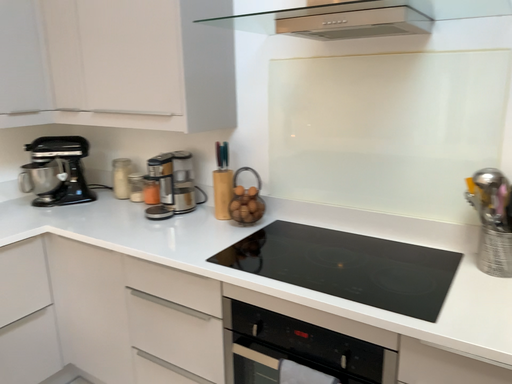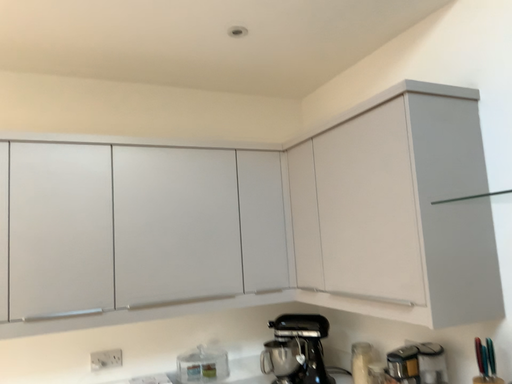
Question: Which way did the camera rotate in the video?

Choices:
 (A) rotated downward
 (B) rotated upward

Answer: (B)